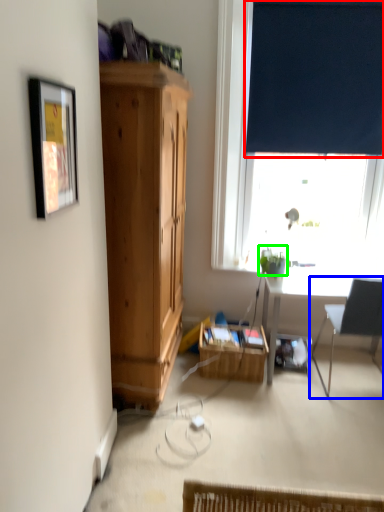
Question: Which object is the closest to the curtain (highlighted by a red box)? Choose among these: chair (highlighted by a blue box) or plant (highlighted by a green box).

Choices:
 (A) chair
 (B) plant

Answer: (B)